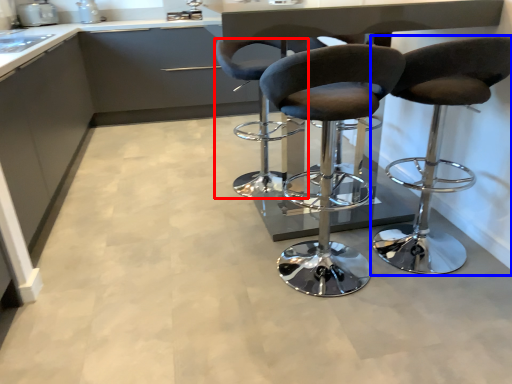
Question: Which object appears closest to the camera in this image, chair (highlighted by a red box) or chair (highlighted by a blue box)?

Choices:
 (A) chair
 (B) chair

Answer: (B)